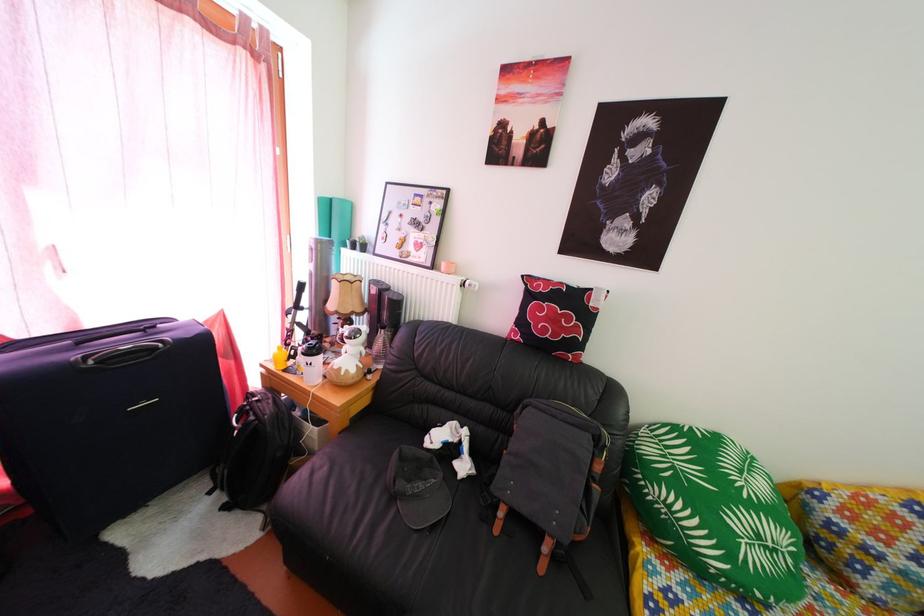
Where is `suitcase handle`? suitcase handle is located at coordinates (116, 333).